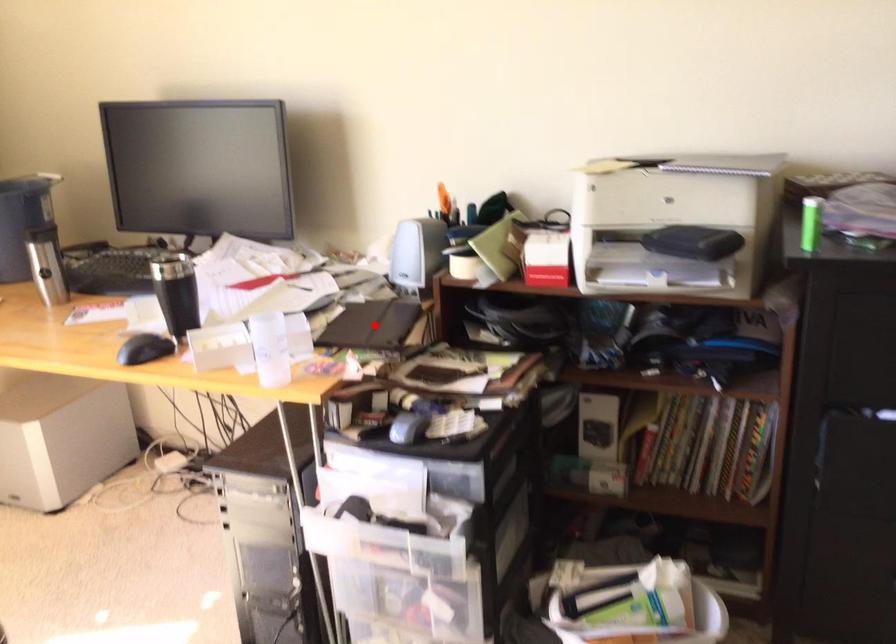
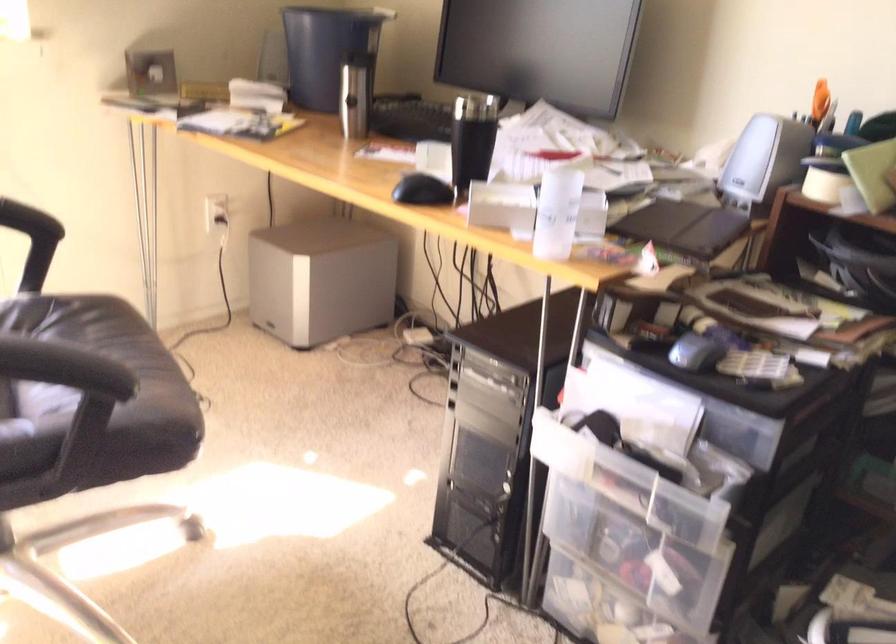
Question: I am providing you with two images of the same scene from different viewpoints. In image1, a red point is highlighted. Considering the same 3D point in image2, which of the following is correct?

Choices:
 (A) It is closer
 (B) It is farther

Answer: (A)